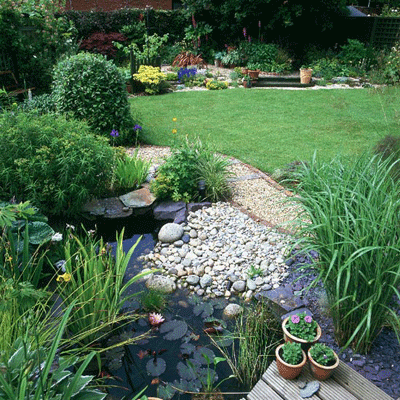
Identify the location of plant vases. (319, 376), (288, 376), (284, 339), (302, 76), (251, 77).